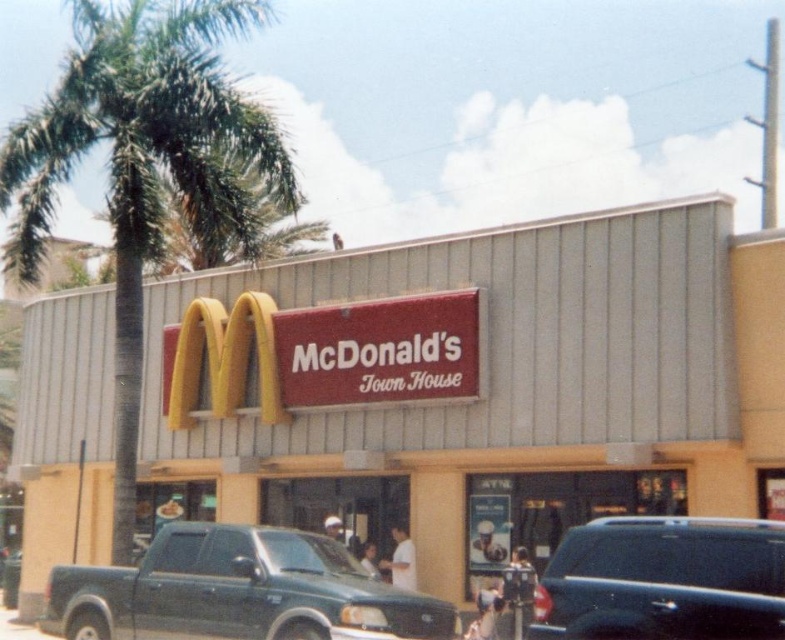
Does red signboard at center have a smaller size compared to green leafy palm tree at left?

Yes, red signboard at center is smaller than green leafy palm tree at left.

Is point (378, 362) closer to camera compared to point (79, 40)?

Yes, it is in front of point (79, 40).

This screenshot has height=640, width=785. What are the coordinates of `red signboard at center` in the screenshot? It's located at (477, 381).

Who is more distant from viewer, (221, 17) or (157, 624)?

Point (221, 17)

Who is more forward, (245, 104) or (316, 636)?

Point (316, 636)

Is point (159, 218) farther from camera compared to point (305, 588)?

Yes.

Where is `green leafy palm tree at left`? The height and width of the screenshot is (640, 785). green leafy palm tree at left is located at coordinates (144, 164).

Between red signboard at center and green matte truck at lower left, which one is positioned higher?

Positioned higher is red signboard at center.

From the picture: Does red signboard at center have a lesser height compared to green matte truck at lower left?

No.

The height and width of the screenshot is (640, 785). I want to click on red signboard at center, so click(x=477, y=381).